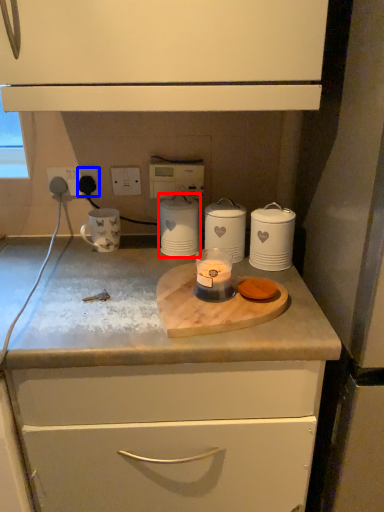
Question: Which point is closer to the camera, home appliance (highlighted by a red box) or electric outlet (highlighted by a blue box)?

Choices:
 (A) home appliance
 (B) electric outlet

Answer: (A)